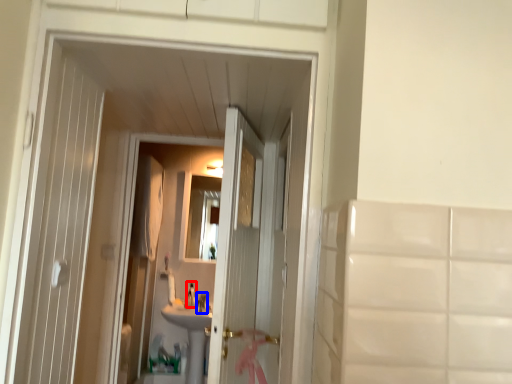
Question: Which object appears farthest to the camera in this image, faucet (highlighted by a red box) or faucet (highlighted by a blue box)?

Choices:
 (A) faucet
 (B) faucet

Answer: (A)